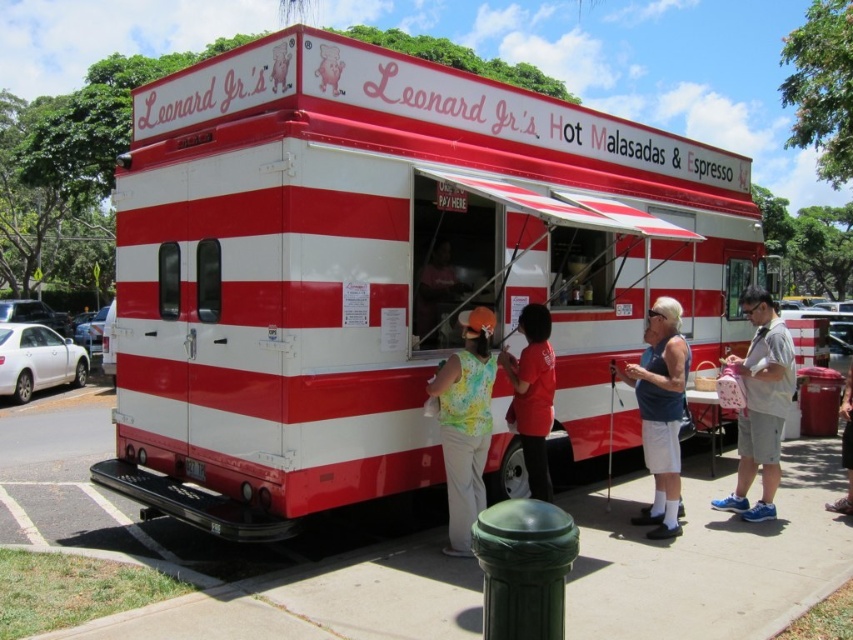
You are standing at the entrance of the park and want to find the red and white striped food truck at center. According to the map, your current position is at point A, and the food truck is marked at point B. If the coordinates of point B are given as 0.419 in the x and 0.447 in the y, can you determine the direction you should walk to reach the food truck?

The red and white striped food truck at center is located at coordinates x 0.419 and y 0.447. To reach it from your current position at point A, you should walk towards the coordinates provided, adjusting your direction based on the map layout.

You are a customer standing in front of Leonard Jr. Hot Malasadas Espress truck and you see two people at the serving window. One is wearing a floral sleeveless top at center and the other a red matte shirt at center. Which person is standing closer to the truck window?

The floral sleeveless top at center is taller than red matte shirt at center, so the person wearing the floral sleeveless top at center is standing closer to the truck window.